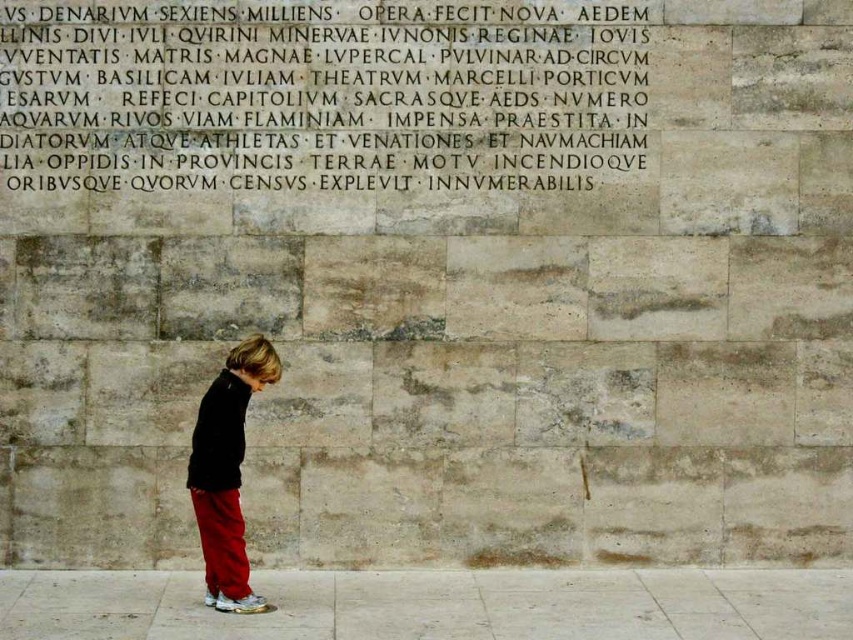
Question: Observing the image, what is the correct spatial positioning of stone inscription at upper center in reference to matte black jacket at center?

Choices:
 (A) right
 (B) left

Answer: (A)

Question: Which of the following is the farthest from the observer?

Choices:
 (A) stone inscription at upper center
 (B) matte black jacket at center

Answer: (A)

Question: Which point is farther to the camera?

Choices:
 (A) (225, 429)
 (B) (22, 184)

Answer: (B)

Question: Which of the following is the closest to the observer?

Choices:
 (A) stone inscription at upper center
 (B) matte black jacket at center

Answer: (B)

Question: Does stone inscription at upper center have a smaller size compared to matte black jacket at center?

Choices:
 (A) no
 (B) yes

Answer: (A)

Question: From the image, what is the correct spatial relationship of stone inscription at upper center in relation to matte black jacket at center?

Choices:
 (A) above
 (B) below

Answer: (A)